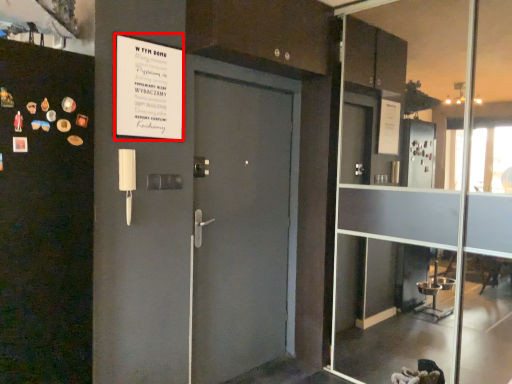
Question: From the image's perspective, considering the relative positions of poster (annotated by the red box) and glass door in the image provided, where is poster (annotated by the red box) located with respect to the staircase?

Choices:
 (A) above
 (B) below

Answer: (A)